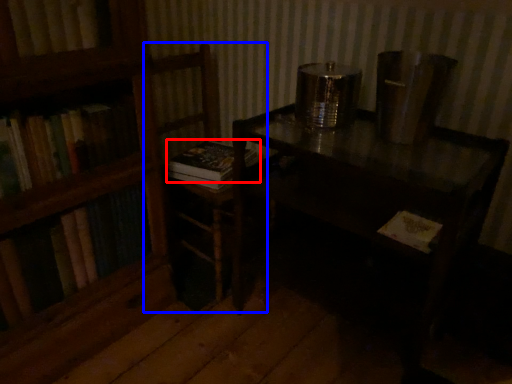
Question: Which object is further to the camera taking this photo, book (highlighted by a red box) or armchair (highlighted by a blue box)?

Choices:
 (A) book
 (B) armchair

Answer: (A)